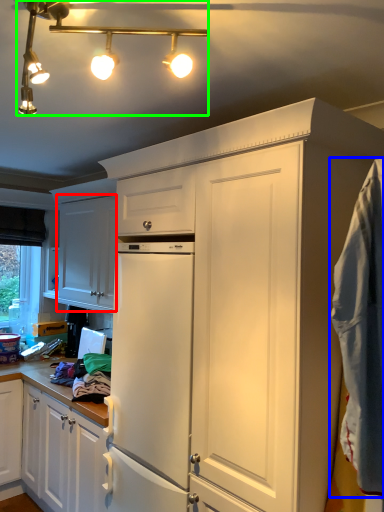
Question: Based on their relative distances, which object is nearer to cabinetry (highlighted by a red box)? Choose from blanket (highlighted by a blue box) and light fixture (highlighted by a green box).

Choices:
 (A) blanket
 (B) light fixture

Answer: (B)